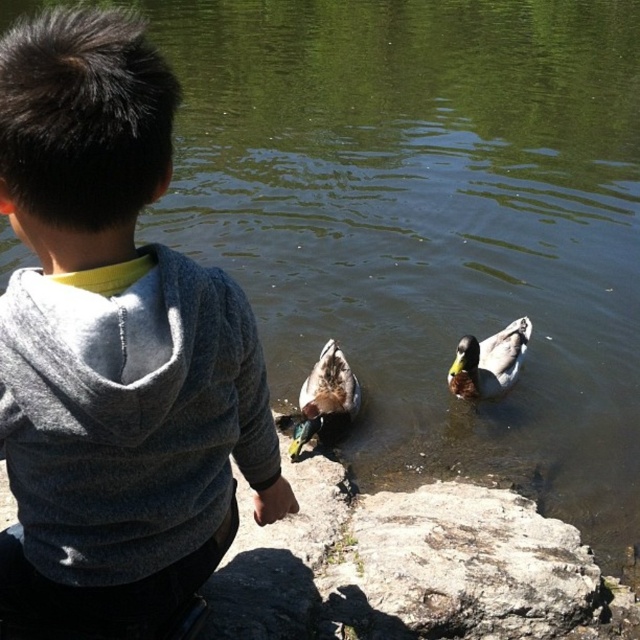
You are standing at the origin point in the image. A gray hoodie at center is located at point (113, 349). If you want to move towards the gray hoodie at center, in which direction should you move?

The gray hoodie at center is located at point (113, 349), so you should move towards that coordinate.

You are a photographer trying to capture the child and the ducks in the scene. You notice a specific point marked at coordinates (113, 349). Where is this point located on the child?

The point at coordinates (113, 349) is located on the gray hoodie at center, which the child is wearing.